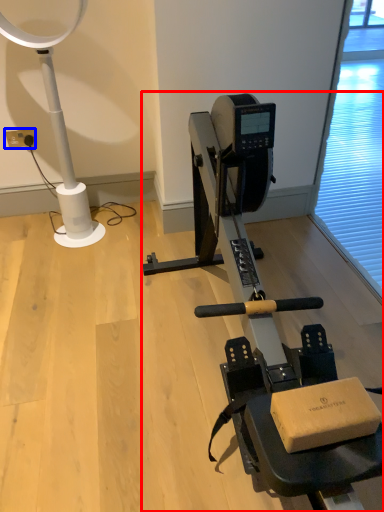
Question: Which of the following is the closest to the observer, stationary bicycle (highlighted by a red box) or electric outlet (highlighted by a blue box)?

Choices:
 (A) stationary bicycle
 (B) electric outlet

Answer: (A)